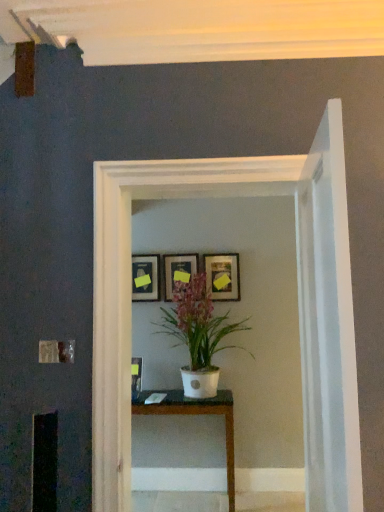
Question: Is matte black picture frame at center, the third picture frame viewed from the left, shorter than matte wooden picture frame at center, which is the second picture frame from right to left?

Choices:
 (A) no
 (B) yes

Answer: (A)

Question: Is matte black picture frame at center, the first picture frame from the right, positioned with its back to matte wooden picture frame at center, which is the 2th picture frame from left to right?

Choices:
 (A) yes
 (B) no

Answer: (B)

Question: From the image's perspective, is matte black picture frame at center, the third picture frame viewed from the left, beneath matte wooden picture frame at center, which is the 2th picture frame from left to right?

Choices:
 (A) yes
 (B) no

Answer: (B)

Question: Would you say matte black picture frame at center, the first picture frame from the right, is a long distance from matte wooden picture frame at center, which is the second picture frame from right to left?

Choices:
 (A) yes
 (B) no

Answer: (B)

Question: Is matte black picture frame at center, the third picture frame viewed from the left, not inside matte wooden picture frame at center, which is the 2th picture frame from left to right?

Choices:
 (A) no
 (B) yes

Answer: (B)

Question: Is matte black picture frame at center, the third picture frame viewed from the left, placed right next to matte wooden picture frame at center, which is the 2th picture frame from left to right?

Choices:
 (A) no
 (B) yes

Answer: (A)

Question: From a real-world perspective, does white glossy glass door at center stand above matte black picture frame at upper center, the 3th picture frame positioned from the right?

Choices:
 (A) yes
 (B) no

Answer: (B)

Question: From the image's perspective, would you say white glossy glass door at center is shown under matte black picture frame at upper center, the 3th picture frame positioned from the right?

Choices:
 (A) yes
 (B) no

Answer: (A)

Question: Would you say white glossy glass door at center is a long distance from matte black picture frame at upper center, the 3th picture frame positioned from the right?

Choices:
 (A) yes
 (B) no

Answer: (A)

Question: Is matte black picture frame at upper center, which is counted as the 1th picture frame, starting from the left, completely or partially inside white glossy glass door at center?

Choices:
 (A) no
 (B) yes

Answer: (A)

Question: Could you tell me if white glossy glass door at center is facing matte black picture frame at upper center, which is counted as the 1th picture frame, starting from the left?

Choices:
 (A) yes
 (B) no

Answer: (B)

Question: Is white glossy glass door at center completely or partially outside of matte black picture frame at upper center, which is counted as the 1th picture frame, starting from the left?

Choices:
 (A) no
 (B) yes

Answer: (B)

Question: Is matte black picture frame at upper center, which is counted as the 1th picture frame, starting from the left, thinner than white glossy table at center?

Choices:
 (A) yes
 (B) no

Answer: (A)